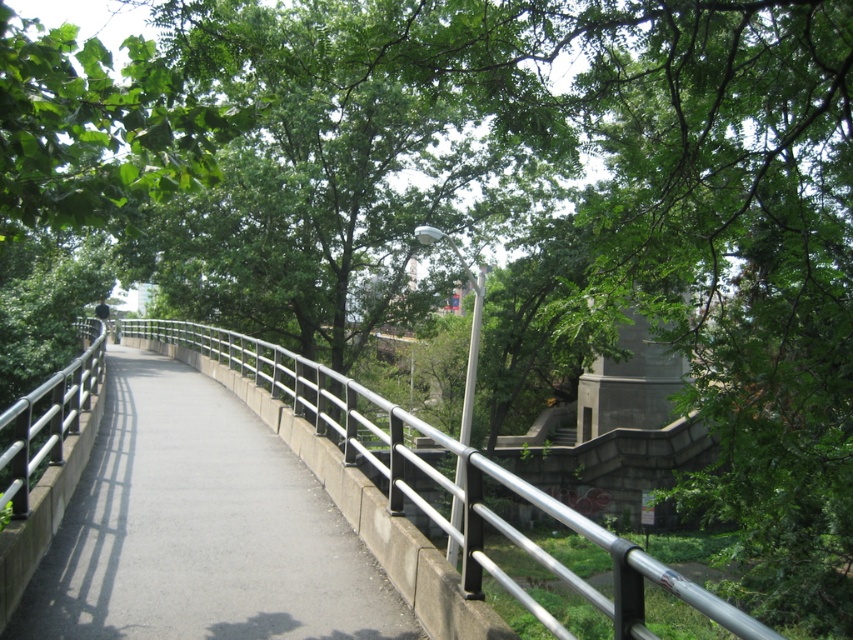
Question: Can you confirm if gray concrete path at center is smaller than silver metallic rail at center?

Choices:
 (A) yes
 (B) no

Answer: (A)

Question: Is the position of gray concrete path at center less distant than that of silver metallic rail at center?

Choices:
 (A) no
 (B) yes

Answer: (A)

Question: Which point is farther from the camera taking this photo?

Choices:
 (A) (138, 595)
 (B) (541, 611)

Answer: (A)

Question: Where is gray concrete path at center located in relation to silver metallic rail at center in the image?

Choices:
 (A) left
 (B) right

Answer: (B)